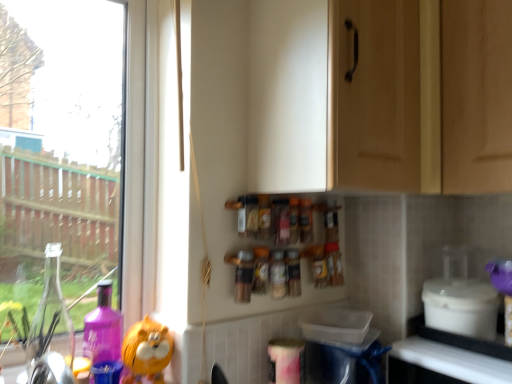
Question: Considering the relative sizes of translucent plastic spice jar at center, which is counted as the 2th bottle, starting from the left, and white plastic container at lower right in the image provided, is translucent plastic spice jar at center, which is counted as the 2th bottle, starting from the left, wider than white plastic container at lower right?

Choices:
 (A) no
 (B) yes

Answer: (A)

Question: From the image's perspective, is translucent plastic spice jar at center, which is counted as the 2th bottle, starting from the left, under white plastic container at lower right?

Choices:
 (A) yes
 (B) no

Answer: (B)

Question: Is white plastic container at lower right completely or partially inside translucent plastic spice jar at center, which is counted as the 2th bottle, starting from the left?

Choices:
 (A) no
 (B) yes

Answer: (A)

Question: Considering the relative positions of translucent plastic spice jar at center, which is counted as the 2th bottle, starting from the left, and white plastic container at lower right in the image provided, is translucent plastic spice jar at center, which is counted as the 2th bottle, starting from the left, behind white plastic container at lower right?

Choices:
 (A) yes
 (B) no

Answer: (A)

Question: Considering the relative sizes of translucent plastic spice jar at center, which is counted as the 2th bottle, starting from the left, and white plastic container at lower right in the image provided, is translucent plastic spice jar at center, which is counted as the 2th bottle, starting from the left, shorter than white plastic container at lower right?

Choices:
 (A) yes
 (B) no

Answer: (B)

Question: Is translucent plastic spice jar at center, which is counted as the 2th bottle, starting from the left, positioned in front of white plastic container at lower right?

Choices:
 (A) yes
 (B) no

Answer: (B)

Question: Can you confirm if translucent plastic spice jar at center, the first bottle from the left, is thinner than translucent plastic spice jar at center, placed as the 2th bottle when sorted from right to left?

Choices:
 (A) no
 (B) yes

Answer: (A)

Question: Is translucent plastic spice jar at center, arranged as the third bottle when viewed from the right, at the right side of translucent plastic spice jar at center, placed as the 2th bottle when sorted from right to left?

Choices:
 (A) no
 (B) yes

Answer: (A)

Question: Is translucent plastic spice jar at center, the first bottle from the left, further to camera compared to translucent plastic spice jar at center, placed as the 2th bottle when sorted from right to left?

Choices:
 (A) no
 (B) yes

Answer: (A)

Question: Can you confirm if translucent plastic spice jar at center, the first bottle from the left, is bigger than translucent plastic spice jar at center, which is counted as the 2th bottle, starting from the left?

Choices:
 (A) yes
 (B) no

Answer: (A)

Question: Can you confirm if translucent plastic spice jar at center, arranged as the third bottle when viewed from the right, is wider than translucent plastic spice jar at center, placed as the 2th bottle when sorted from right to left?

Choices:
 (A) no
 (B) yes

Answer: (B)

Question: Does translucent plastic spice jar at center, arranged as the third bottle when viewed from the right, turn towards translucent plastic spice jar at center, which is counted as the 2th bottle, starting from the left?

Choices:
 (A) no
 (B) yes

Answer: (A)

Question: Considering the relative sizes of white glossy counter top at lower right and matte wood cabinet at upper center in the image provided, is white glossy counter top at lower right wider than matte wood cabinet at upper center?

Choices:
 (A) yes
 (B) no

Answer: (B)